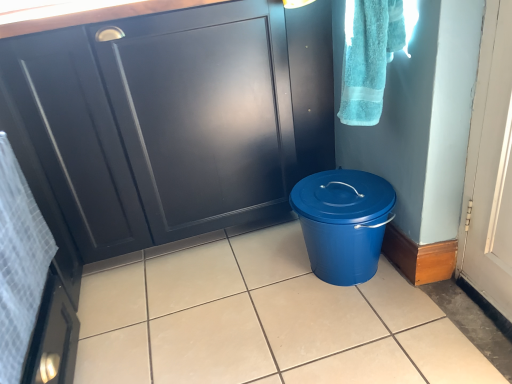
I want to click on free spot to the right of white textured towel at left, which is counted as the 2th bath towel, starting from the right, so 185,348.